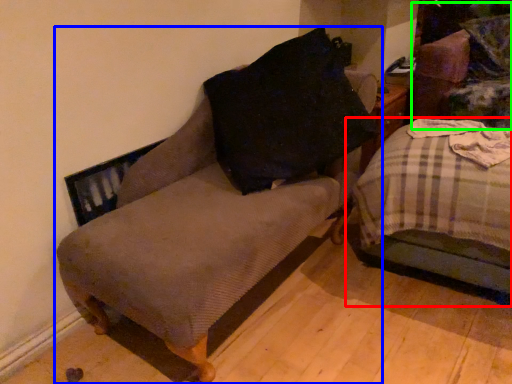
Question: Which object is positioned farthest from studio couch (highlighted by a red box)? Select from furniture (highlighted by a blue box) and swivel chair (highlighted by a green box).

Choices:
 (A) furniture
 (B) swivel chair

Answer: (B)